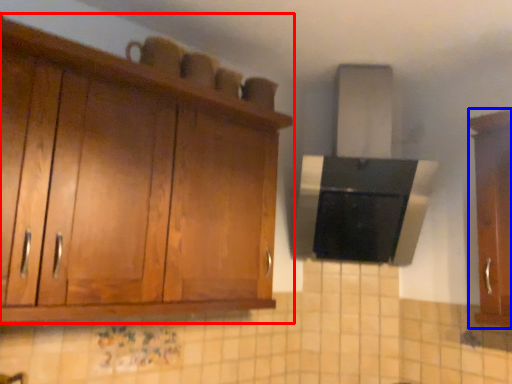
Question: Among these objects, which one is nearest to the camera, cabinetry (highlighted by a red box) or cabinetry (highlighted by a blue box)?

Choices:
 (A) cabinetry
 (B) cabinetry

Answer: (A)